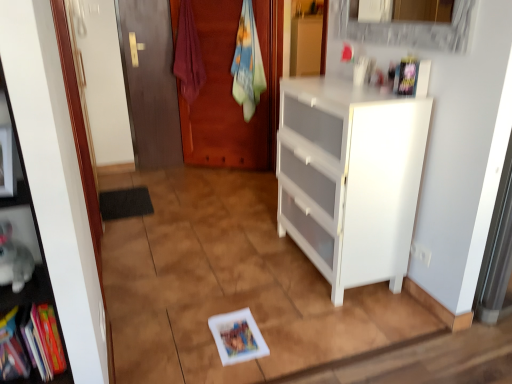
Question: Considering the relative positions of matte wood door at left and multicolored fabric towel at center, which appears as the second laundry when viewed from the left, in the image provided, is matte wood door at left to the left of multicolored fabric towel at center, which appears as the second laundry when viewed from the left, from the viewer's perspective?

Choices:
 (A) no
 (B) yes

Answer: (B)

Question: From the image's perspective, is matte wood door at left on multicolored fabric towel at center, which is counted as the first laundry, starting from the right?

Choices:
 (A) yes
 (B) no

Answer: (B)

Question: Is the depth of matte wood door at left greater than that of multicolored fabric towel at center, which appears as the second laundry when viewed from the left?

Choices:
 (A) no
 (B) yes

Answer: (B)

Question: Could multicolored fabric towel at center, which is counted as the first laundry, starting from the right, be considered to be inside matte wood door at left?

Choices:
 (A) yes
 (B) no

Answer: (B)

Question: From a real-world perspective, is matte wood door at left on top of multicolored fabric towel at center, which appears as the second laundry when viewed from the left?

Choices:
 (A) yes
 (B) no

Answer: (B)

Question: Considering the positions of white matte book at center, acting as the 2th book starting from the right, and black matte cabinet at left in the image, is white matte book at center, acting as the 2th book starting from the right, bigger or smaller than black matte cabinet at left?

Choices:
 (A) small
 (B) big

Answer: (A)

Question: Is white matte book at center, which ranks as the fourth book in top-to-bottom order, inside the boundaries of black matte cabinet at left, or outside?

Choices:
 (A) inside
 (B) outside

Answer: (B)

Question: Considering the positions of white matte book at center, which is the 3th book in left-to-right order, and black matte cabinet at left in the image, is white matte book at center, which is the 3th book in left-to-right order, taller or shorter than black matte cabinet at left?

Choices:
 (A) short
 (B) tall

Answer: (A)

Question: Is point (252, 357) closer or farther from the camera than point (41, 281)?

Choices:
 (A) farther
 (B) closer

Answer: (A)

Question: Is matte wood door at left wider or thinner than matte red towel at center, the 2th laundry viewed from the right?

Choices:
 (A) wide
 (B) thin

Answer: (B)

Question: From the image's perspective, is matte wood door at left located above or below matte red towel at center, which is counted as the first laundry, starting from the left?

Choices:
 (A) below
 (B) above

Answer: (A)

Question: From a real-world perspective, relative to matte red towel at center, the 2th laundry viewed from the right, is matte wood door at left vertically above or below?

Choices:
 (A) below
 (B) above

Answer: (A)

Question: From their relative heights in the image, would you say matte wood door at left is taller or shorter than matte red towel at center, the 2th laundry viewed from the right?

Choices:
 (A) short
 (B) tall

Answer: (B)

Question: Is multicolored fabric book at lower left, the second book ordered from the bottom, situated inside white glossy cabinet at right, the 1th cabinetry in the bottom-to-top sequence, or outside?

Choices:
 (A) inside
 (B) outside

Answer: (B)

Question: In the image, is multicolored fabric book at lower left, the fourth book in the right-to-left sequence, positioned in front of or behind white glossy cabinet at right, the 1th cabinetry in the bottom-to-top sequence?

Choices:
 (A) behind
 (B) front

Answer: (B)